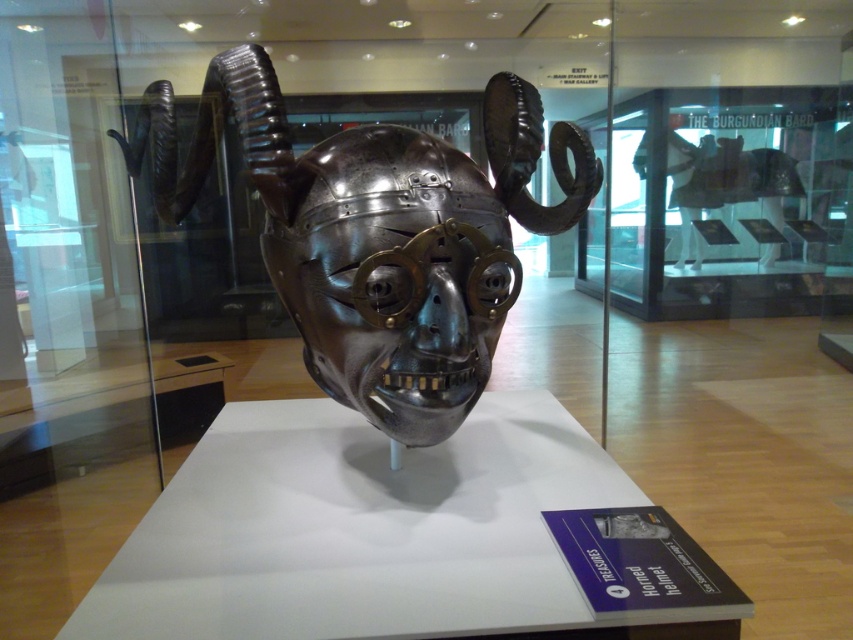
You are an art restorer examining the museum exhibit. You need to determine the vertical space required to store both the polished metal helmet at center and the polished metal skull at center. Which object requires more vertical space?

The polished metal helmet at center is taller than the polished metal skull at center, so it requires more vertical space.

You are a security guard in the museum. You need to check the distance between the polished metal helmet at center and the polished metal skull at center. Which one is positioned to the right?

The polished metal helmet at center is positioned to the right of the polished metal skull at center.

You are an art conservator tasked with placing a protective glass cover over the polished metal helmet at center. The glass cover must be positioned precisely at coordinates 0.366, 0.444. Can you confirm if the helmet is already centered at this location?

Yes, the polished metal helmet at center is located exactly at point (378, 234), so the glass cover can be placed there precisely.